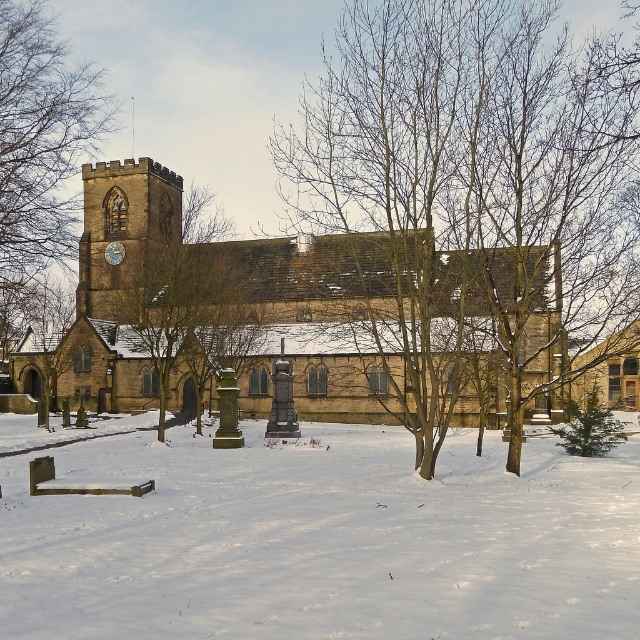
You are standing in the winter scene and want to walk from the path to the church entrance. There is white powdery snow at lower center and a bare wood tree at center in your way. Which direction should you move to avoid stepping on the snow?

Result: To avoid stepping on the white powdery snow at lower center, you should move to the right side of the bare wood tree at center since the snow is to the left of the tree.

You are planning to build a small wooden shed in the winter scene shown. The shed requires a foundation that can support its weight. Based on the image, which location would be more suitable for the foundation? The white powdery snow at lower center or the brown stone church at center? Explain your choice using the scene details.

The brown stone church at center is a better foundation because the white powdery snow at lower center is thinner and less stable compared to the solid structure of the church.

You are planning to build a snowman using the white powdery snow at lower center. However, there is a bare wood tree at center nearby. Considering the height of the snow, will you have enough snow to make a snowman taller than the tree?

The white powdery snow at lower center has a lesser height compared to the bare wood tree at center. Therefore, you won not have enough snow to make a snowman taller than the tree.